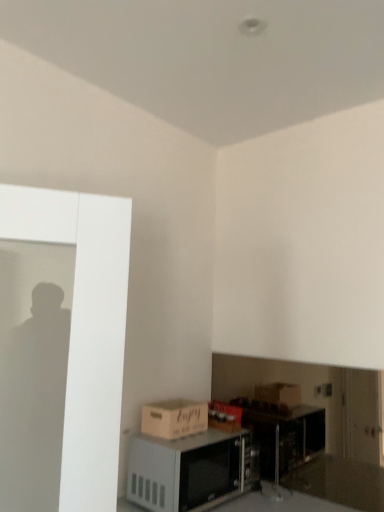
Locate an element on the screen. The height and width of the screenshot is (512, 384). vacant space situated above white matte microwave at lower center (from a real-world perspective) is located at coordinates (199, 433).